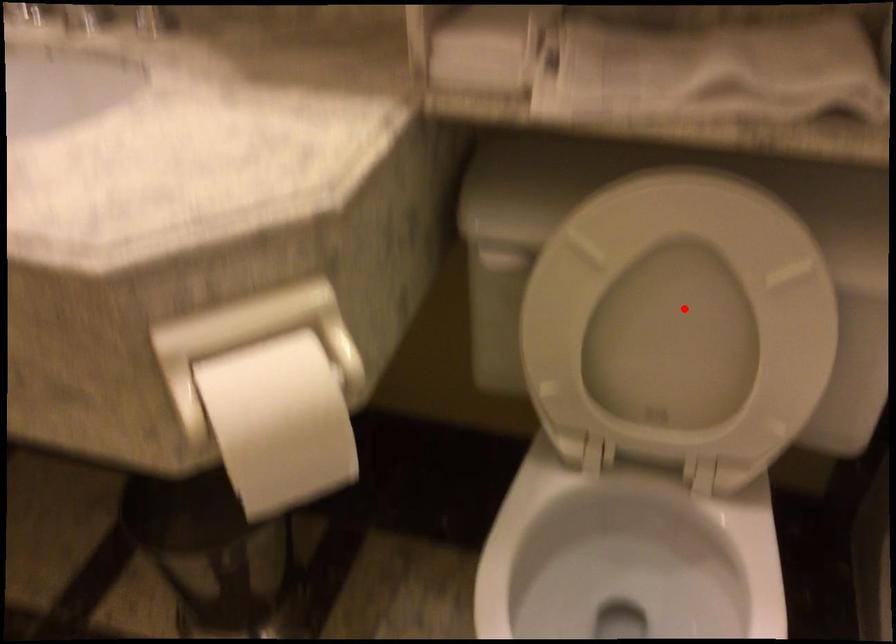
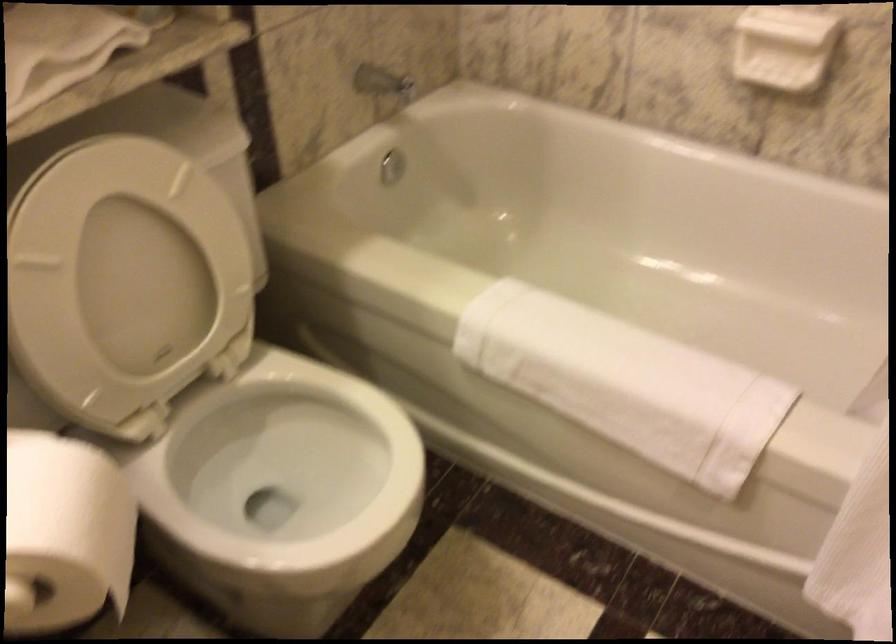
Locate, in the second image, the point that corresponds to the highlighted location in the first image.

(126, 266)